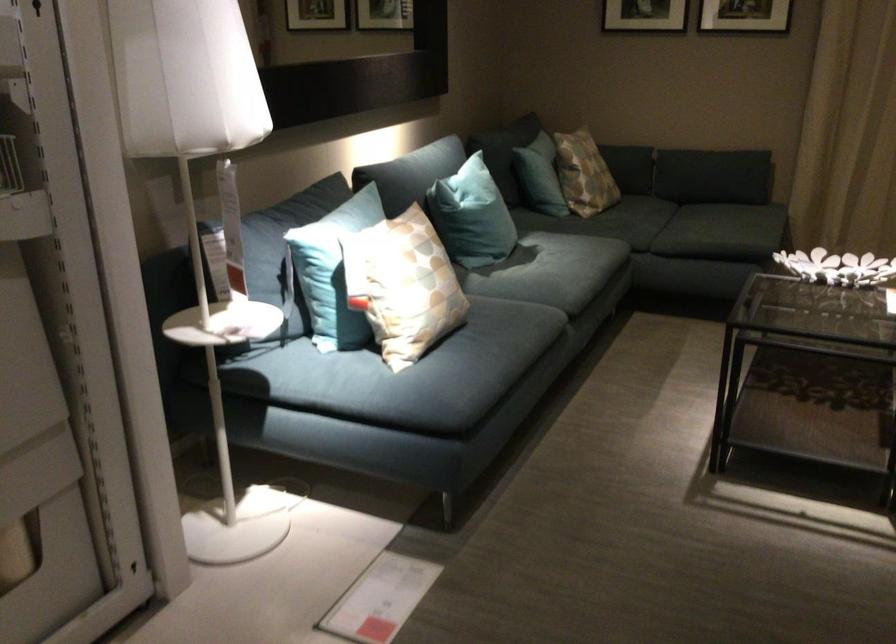
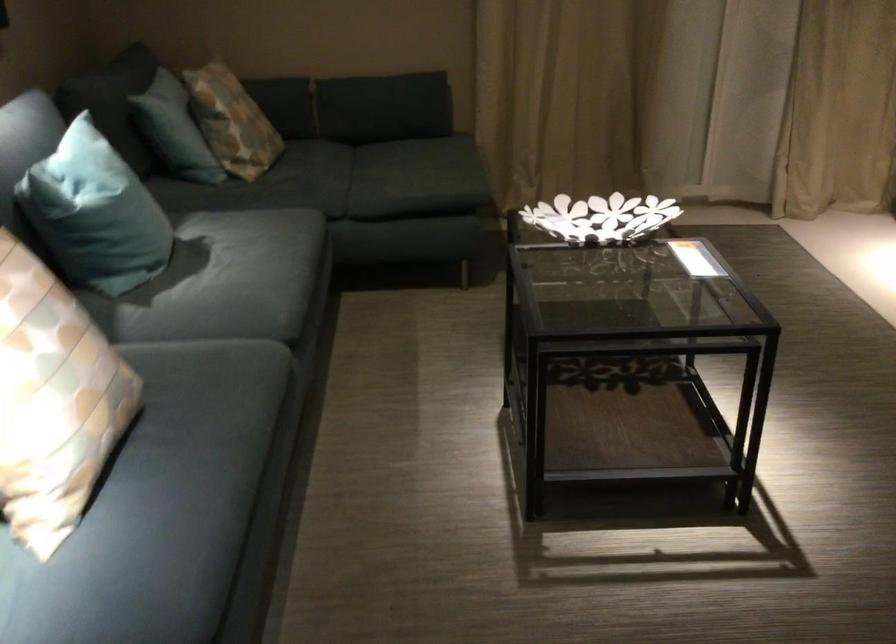
Find the pixel in the second image that matches point (544, 163) in the first image.

(174, 129)